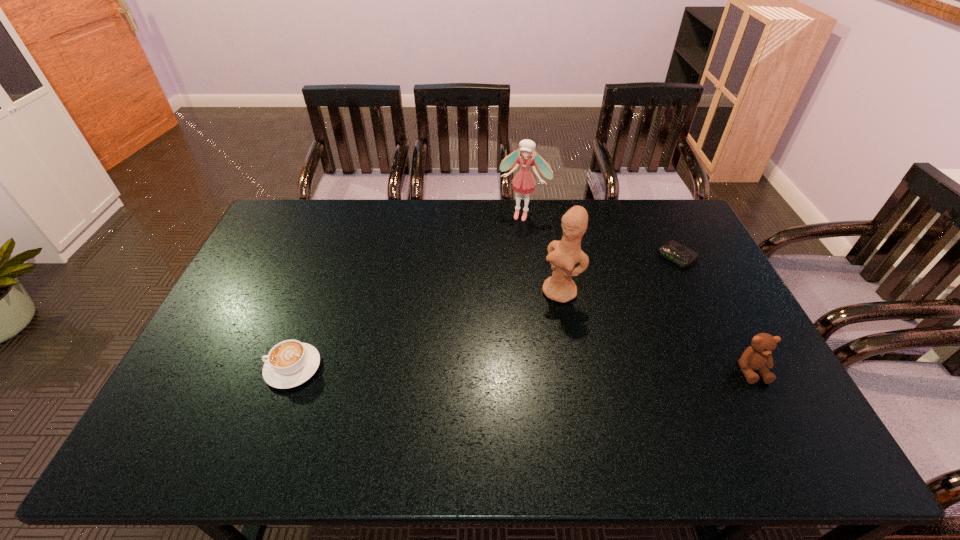
Find the location of a particular element. The image size is (960, 540). blank space located 0.070m on the face of the teddy bear is located at coordinates (772, 410).

In order to click on free space located 0.070m on the display of the alarm clock in this screenshot , I will do `click(655, 275)`.

You are a GUI agent. You are given a task and a screenshot of the screen. Output one action in this format:
    pyautogui.click(x=<x>, y=<y>)
    Task: Click on the vacant space situated 0.050m on the display of the alarm clock
    The height and width of the screenshot is (540, 960).
    Given the screenshot: What is the action you would take?
    pyautogui.click(x=659, y=272)

In order to click on vacant space located 0.080m on the display of the alarm clock in this screenshot , I will do `click(653, 276)`.

This screenshot has width=960, height=540. I want to click on vacant area situated on the front-facing side of the doll, so click(x=505, y=247).

Where is `free point located 0.220m on the front-facing side of the doll`? The height and width of the screenshot is (540, 960). free point located 0.220m on the front-facing side of the doll is located at coordinates (499, 260).

Identify the location of vacant space situated 0.280m on the front-facing side of the doll. (494, 272).

You are a GUI agent. You are given a task and a screenshot of the screen. Output one action in this format:
    pyautogui.click(x=<x>, y=<y>)
    Task: Click on the vacant space located on the front-facing side of the figurine
    
    Given the screenshot: What is the action you would take?
    pyautogui.click(x=531, y=323)

The height and width of the screenshot is (540, 960). I want to click on free space located on the front-facing side of the figurine, so click(x=513, y=342).

I want to click on free spot located 0.200m on the front-facing side of the figurine, so click(x=511, y=345).